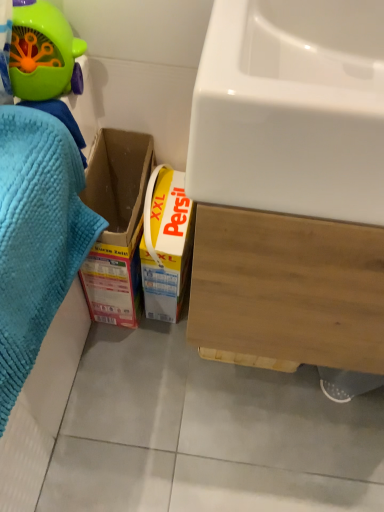
Question: Based on their positions, is white glossy sink at upper right located to the left or right of blue textured towel at left?

Choices:
 (A) left
 (B) right

Answer: (B)

Question: Is white glossy sink at upper right in front of or behind blue textured towel at left in the image?

Choices:
 (A) behind
 (B) front

Answer: (B)

Question: Which object is the closest to the blue textured towel at left?

Choices:
 (A) green plastic toy at upper left
 (B) white glossy sink at upper right

Answer: (A)

Question: Which object is positioned farthest from the white glossy sink at upper right?

Choices:
 (A) green plastic toy at upper left
 (B) blue textured towel at left

Answer: (A)